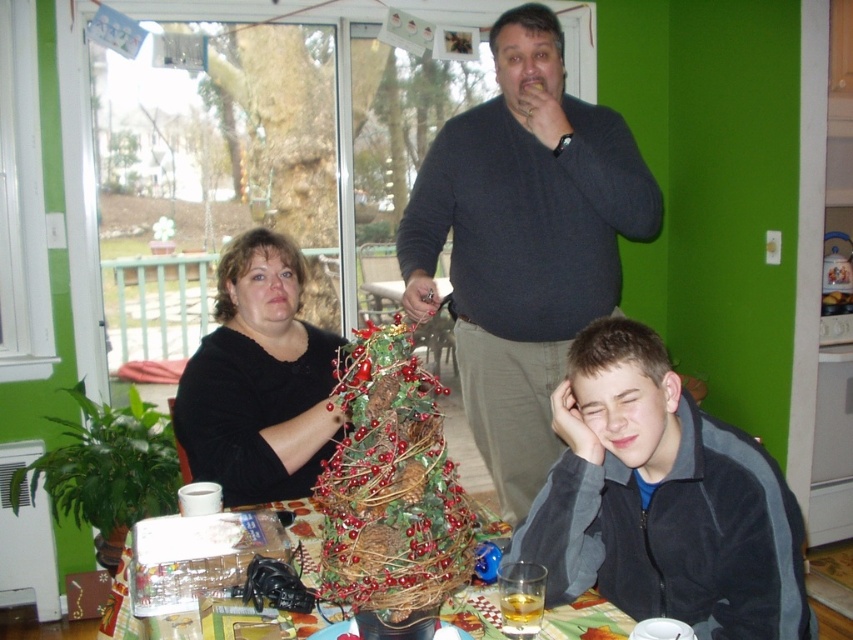
Does bright red berries at center have a larger size compared to wooden table at center?

Actually, bright red berries at center might be smaller than wooden table at center.

Is bright red berries at center below wooden table at center?

Actually, bright red berries at center is above wooden table at center.

You are a GUI agent. You are given a task and a screenshot of the screen. Output one action in this format:
    pyautogui.click(x=<x>, y=<y>)
    Task: Click on the bright red berries at center
    
    Given the screenshot: What is the action you would take?
    pyautogui.click(x=392, y=492)

Between black matte shirt at center and wooden table at center, which one appears on the left side from the viewer's perspective?

black matte shirt at center is more to the left.

Is black matte shirt at center above wooden table at center?

Yes, black matte shirt at center is above wooden table at center.

Between point (265, 339) and point (126, 579), which one is positioned behind?

The point (265, 339) is behind.

I want to click on black matte shirt at center, so click(x=258, y=380).

Does point (457, 198) lie in front of point (241, 314)?

No, (457, 198) is behind (241, 314).

Is point (482, 419) positioned after point (206, 404)?

Yes, it is.

Identify the location of dark gray sweater at upper center. This screenshot has width=853, height=640. (523, 241).